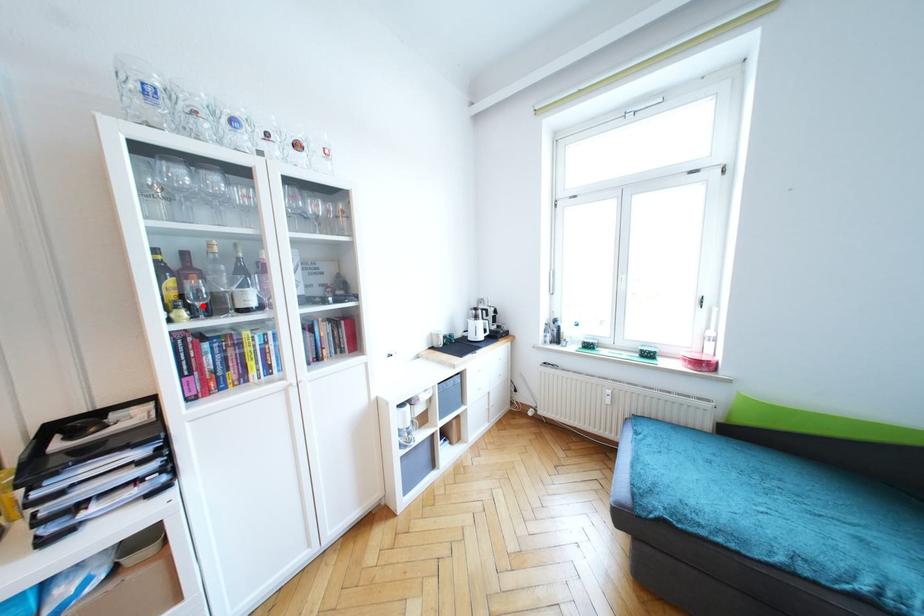
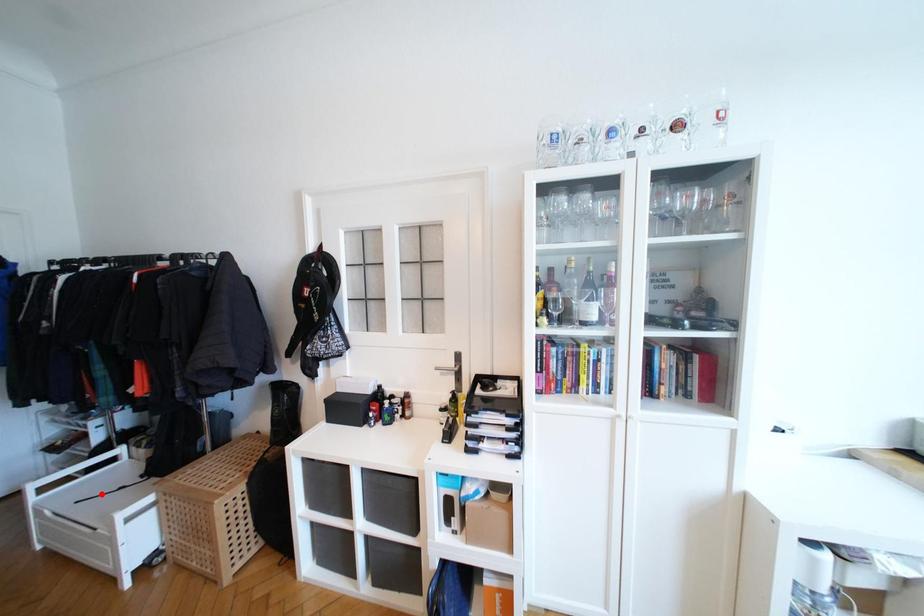
I am providing you with two images of the same scene from different viewpoints. A red point is marked on the first image and another point is marked on the second image. Does the point marked in image1 correspond to the same location as the one in image2?

No